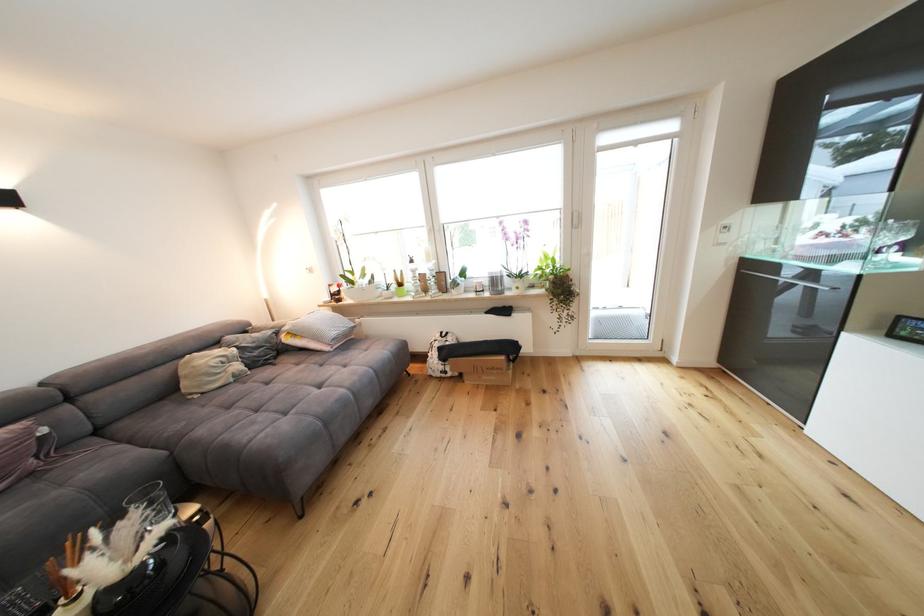
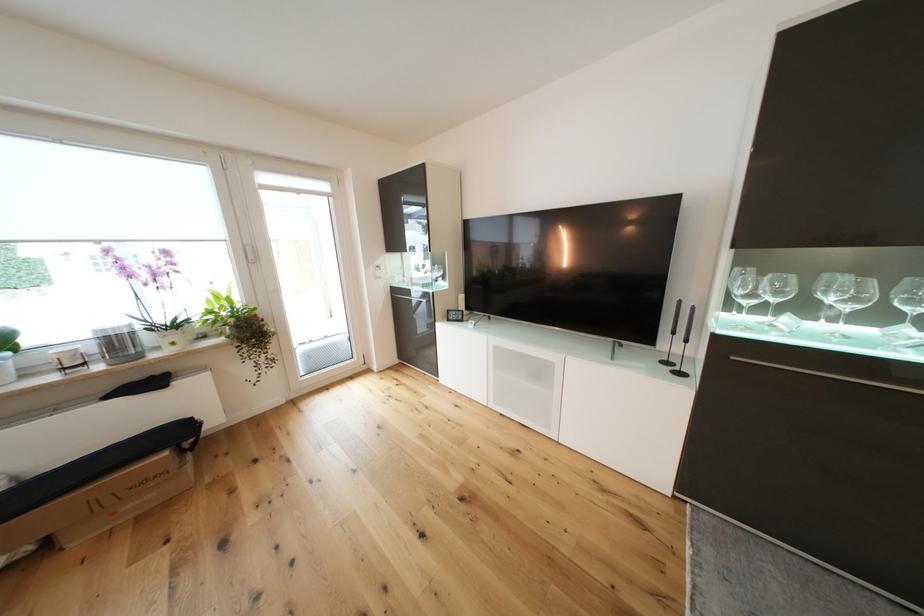
Where in the second image is the point corresponding to point (511, 359) from the first image?

(172, 455)